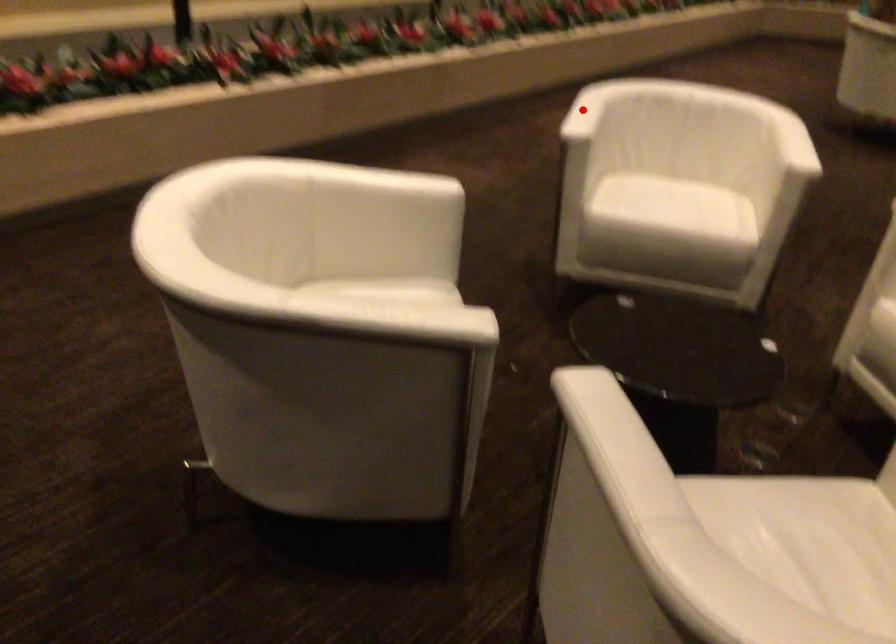
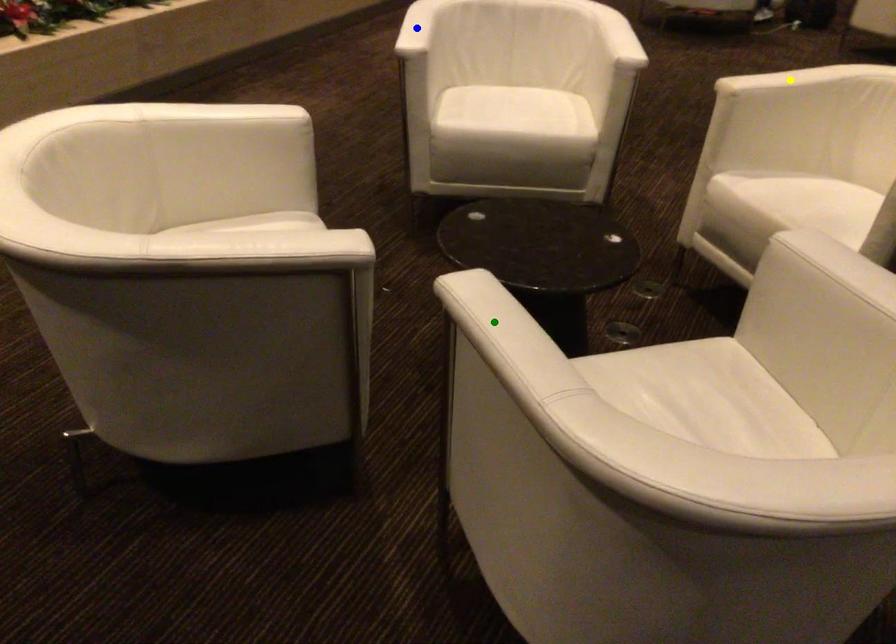
Question: I am providing you with two images of the same scene from different viewpoints. A red point is marked on the first image. You are given multiple points on the second image. Which point in image 2 is actually the same real-world point as the red point in image 1?

Choices:
 (A) blue point
 (B) yellow point
 (C) green point

Answer: (A)